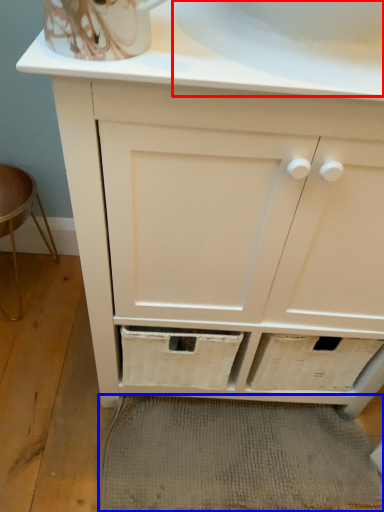
Question: Which object appears farthest to the camera in this image, sink (highlighted by a red box) or bath mat (highlighted by a blue box)?

Choices:
 (A) sink
 (B) bath mat

Answer: (B)